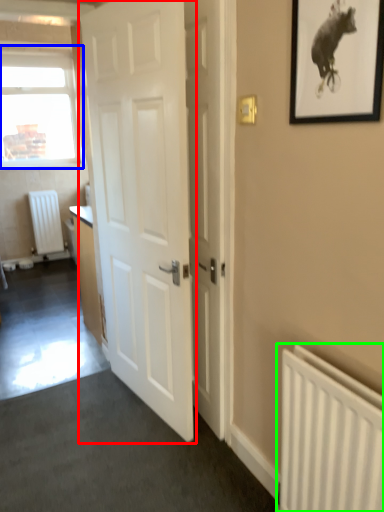
Question: Which is farther away from door (highlighted by a red box)? window (highlighted by a blue box) or radiator (highlighted by a green box)?

Choices:
 (A) window
 (B) radiator

Answer: (A)